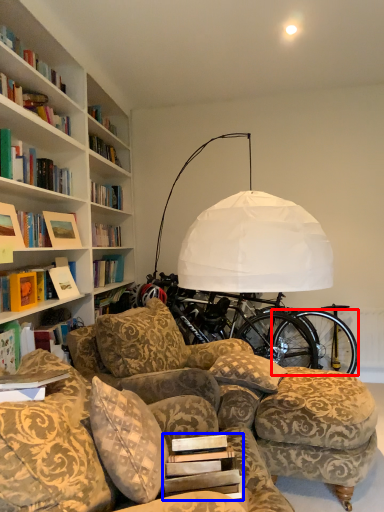
Question: Which point is further to the camera, bicycle wheel (highlighted by a red box) or paperback book (highlighted by a blue box)?

Choices:
 (A) bicycle wheel
 (B) paperback book

Answer: (A)